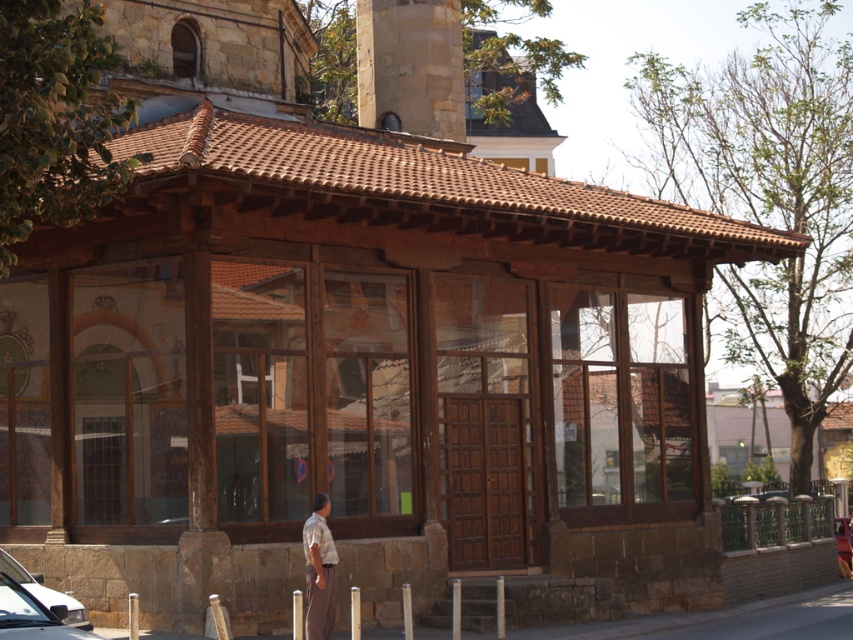
Is light brown fabric shirt at center bigger than white glossy car at lower left?

No, light brown fabric shirt at center is not bigger than white glossy car at lower left.

Can you confirm if light brown fabric shirt at center is positioned below white glossy car at lower left?

No.

Describe the element at coordinates (318, 570) in the screenshot. This screenshot has width=853, height=640. I see `light brown fabric shirt at center` at that location.

Where is `light brown fabric shirt at center`? The width and height of the screenshot is (853, 640). light brown fabric shirt at center is located at coordinates (318, 570).

Does light brown fabric shirt at center have a greater height compared to metallic red car at center?

Indeed, light brown fabric shirt at center has a greater height compared to metallic red car at center.

Is light brown fabric shirt at center to the left of metallic red car at center from the viewer's perspective?

Indeed, light brown fabric shirt at center is positioned on the left side of metallic red car at center.

Image resolution: width=853 pixels, height=640 pixels. What do you see at coordinates (318, 570) in the screenshot?
I see `light brown fabric shirt at center` at bounding box center [318, 570].

Where is `light brown fabric shirt at center`? light brown fabric shirt at center is located at coordinates (318, 570).

Which is behind, point (51, 595) or point (846, 540)?

The point (846, 540) is behind.

Which is more to the right, white glossy car at lower left or metallic red car at center?

metallic red car at center is more to the right.

Who is more forward, (42, 598) or (850, 557)?

Positioned in front is point (42, 598).

The image size is (853, 640). I want to click on white glossy car at lower left, so click(45, 593).